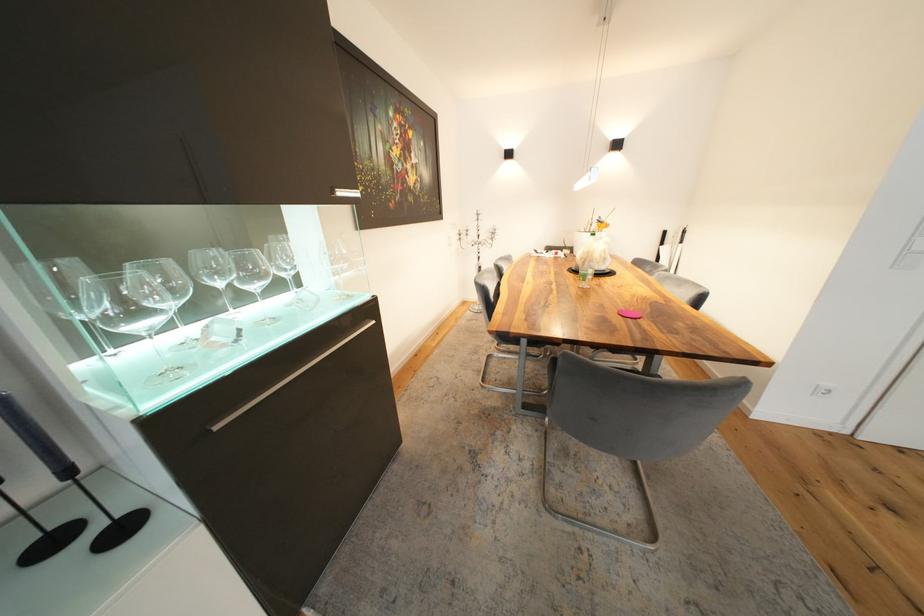
Which object does [43,533] point to?

It corresponds to the black candlestick holder in the image.